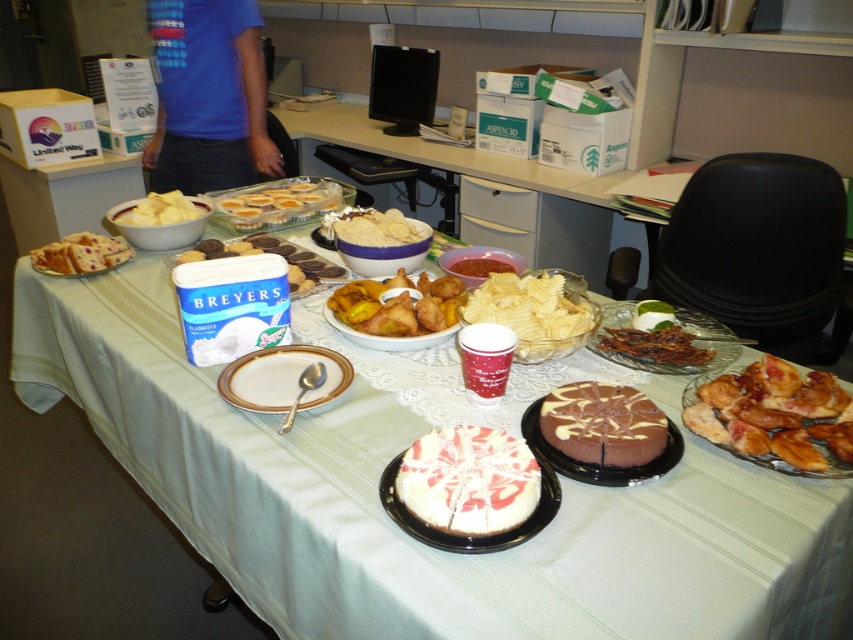
Does golden crispy chicken at center come in front of brown crispy bacon at center?

That is True.

Does golden crispy chicken at center appear on the left side of brown crispy bacon at center?

No, golden crispy chicken at center is not to the left of brown crispy bacon at center.

Does point (737, 413) come in front of point (660, 340)?

Yes, point (737, 413) is in front of point (660, 340).

The height and width of the screenshot is (640, 853). In order to click on golden crispy chicken at center in this screenshot , I will do `click(769, 413)`.

Does swirled white cake at center appear on the left side of white matte bowl at upper left?

In fact, swirled white cake at center is to the right of white matte bowl at upper left.

Looking at this image, can you confirm if swirled white cake at center is smaller than white matte bowl at upper left?

Yes.

Between point (415, 512) and point (178, 204), which one is positioned behind?

Point (178, 204)

Where is `swirled white cake at center`? swirled white cake at center is located at coordinates (469, 481).

Can you confirm if wavy brown chips at center is wider than matte white cupcakes at center?

No.

What do you see at coordinates (534, 314) in the screenshot? I see `wavy brown chips at center` at bounding box center [534, 314].

Where is `wavy brown chips at center`? Image resolution: width=853 pixels, height=640 pixels. wavy brown chips at center is located at coordinates (x=534, y=314).

The height and width of the screenshot is (640, 853). In order to click on wavy brown chips at center in this screenshot , I will do `click(534, 314)`.